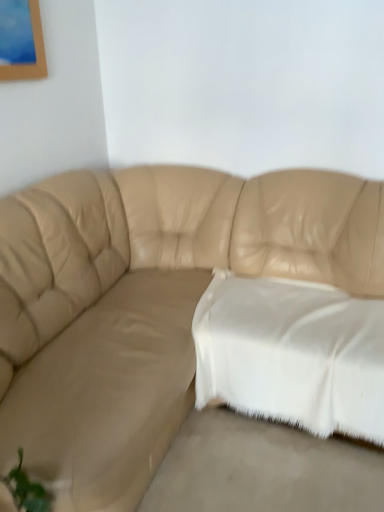
Question: Would you consider beige leather couch at lower left to be distant from beige leather couch at center?

Choices:
 (A) no
 (B) yes

Answer: (A)

Question: Is beige leather couch at lower left to the right of beige leather couch at center from the viewer's perspective?

Choices:
 (A) yes
 (B) no

Answer: (A)

Question: Is beige leather couch at lower left not within beige leather couch at center?

Choices:
 (A) yes
 (B) no

Answer: (B)

Question: Does beige leather couch at lower left lie in front of beige leather couch at center?

Choices:
 (A) no
 (B) yes

Answer: (A)

Question: Can beige leather couch at center be found inside beige leather couch at lower left?

Choices:
 (A) no
 (B) yes

Answer: (A)

Question: Is beige leather couch at lower left bigger or smaller than beige leather couch at center?

Choices:
 (A) small
 (B) big

Answer: (A)

Question: From a real-world perspective, is beige leather couch at lower left physically located above or below beige leather couch at center?

Choices:
 (A) above
 (B) below

Answer: (B)

Question: Is point (150, 507) closer or farther from the camera than point (81, 184)?

Choices:
 (A) closer
 (B) farther

Answer: (A)

Question: From the image's perspective, relative to beige leather couch at center, is beige leather couch at lower left above or below?

Choices:
 (A) below
 (B) above

Answer: (A)

Question: Considering the positions of beige leather couch at center and beige leather couch at lower left in the image, is beige leather couch at center wider or thinner than beige leather couch at lower left?

Choices:
 (A) thin
 (B) wide

Answer: (B)

Question: From the image's perspective, is beige leather couch at center above or below beige leather couch at lower left?

Choices:
 (A) above
 (B) below

Answer: (A)

Question: Considering the positions of point (284, 215) and point (183, 440), is point (284, 215) closer or farther from the camera than point (183, 440)?

Choices:
 (A) closer
 (B) farther

Answer: (B)

Question: From their relative heights in the image, would you say beige leather couch at center is taller or shorter than beige leather couch at lower left?

Choices:
 (A) tall
 (B) short

Answer: (A)

Question: Is beige leather couch at lower left to the left or to the right of white soft fabric pillow at center in the image?

Choices:
 (A) left
 (B) right

Answer: (A)

Question: Is beige leather couch at lower left spatially inside white soft fabric pillow at center, or outside of it?

Choices:
 (A) outside
 (B) inside

Answer: (A)